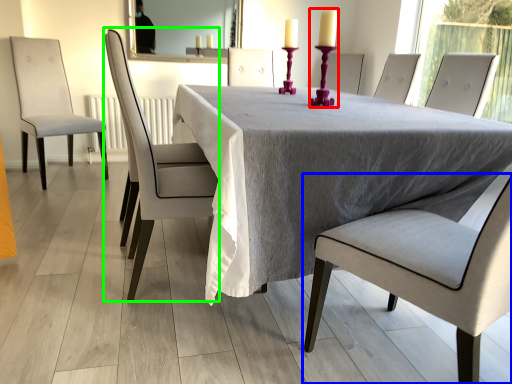
Question: Which object is the closest to the candle holder (highlighted by a red box)? Choose among these: chair (highlighted by a blue box) or chair (highlighted by a green box).

Choices:
 (A) chair
 (B) chair

Answer: (B)